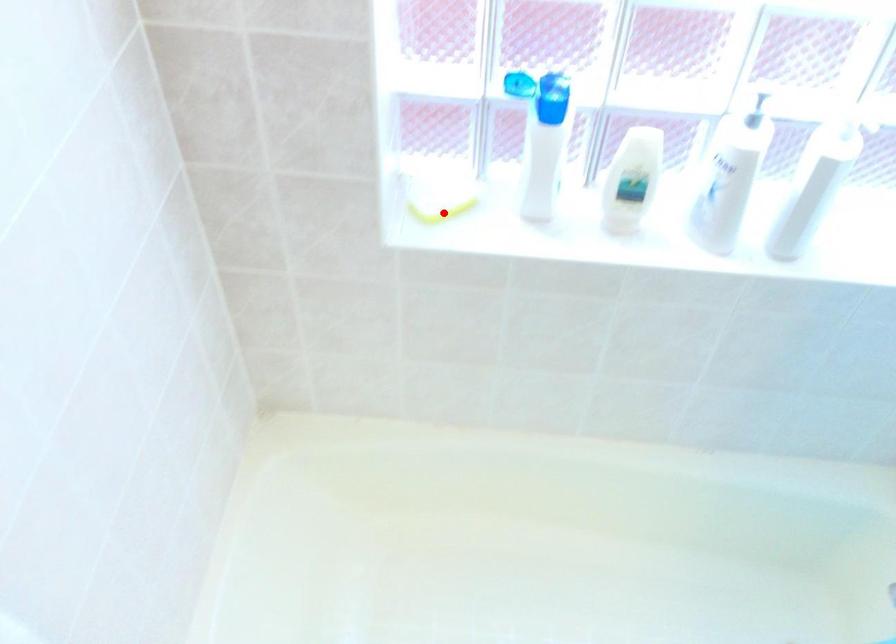
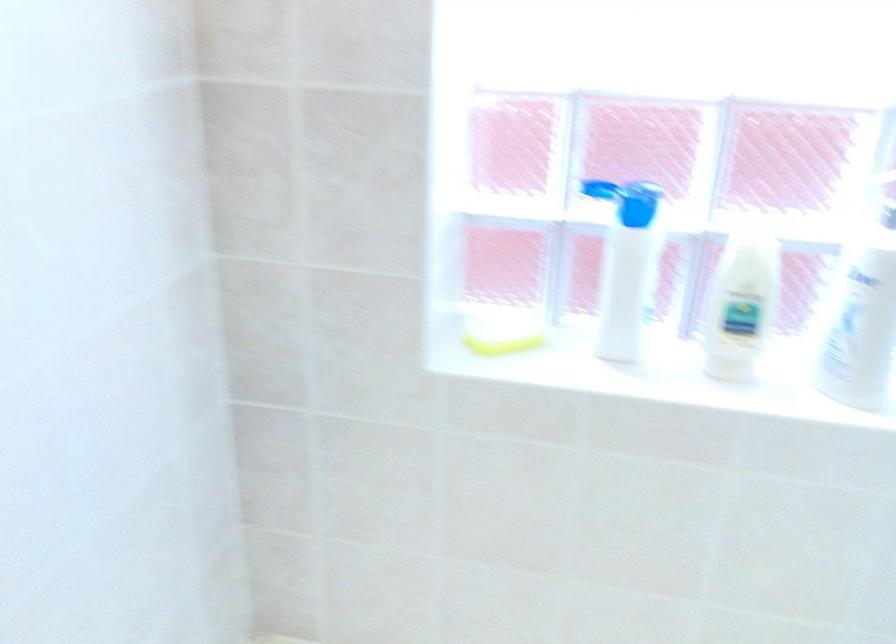
Question: I am providing you with two images of the same scene from different viewpoints. Given a red point in image1, look at the same physical point in image2. Is it:

Choices:
 (A) Closer to the viewpoint
 (B) Farther from the viewpoint

Answer: (A)